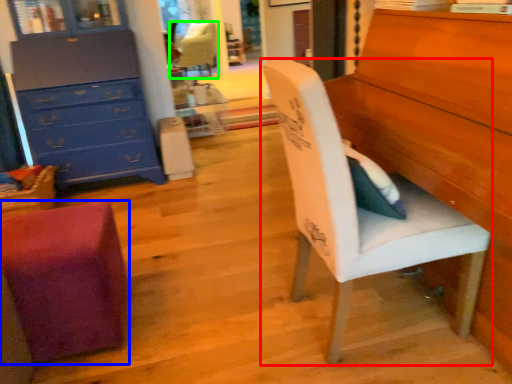
Question: Based on their relative distances, which object is farther from chair (highlighted by a red box)? Choose from chair (highlighted by a blue box) and chair (highlighted by a green box).

Choices:
 (A) chair
 (B) chair

Answer: (B)